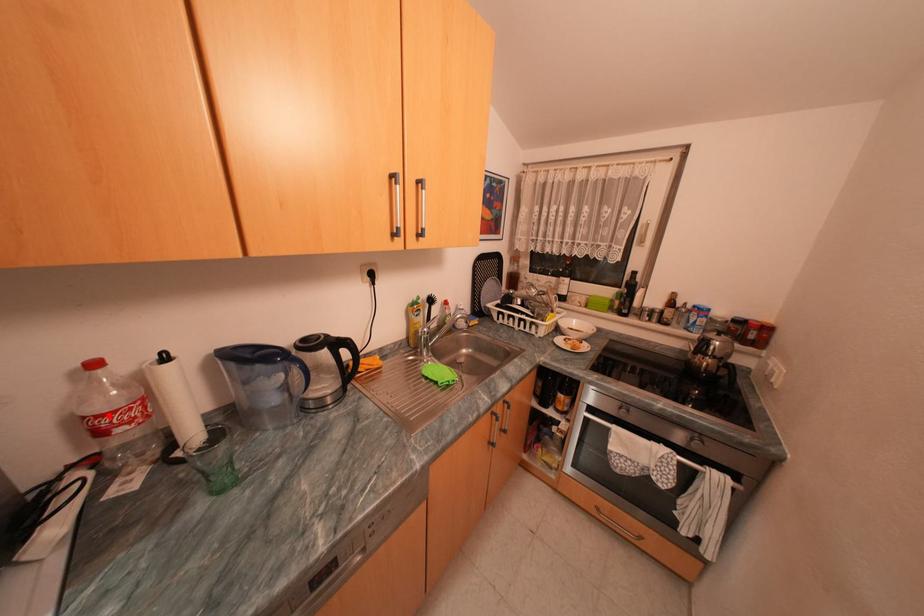
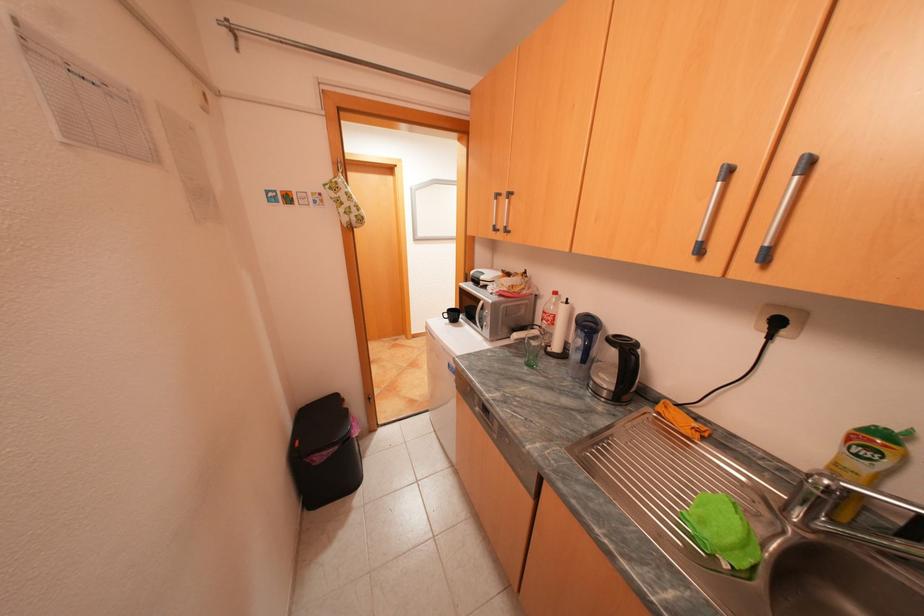
In the second image, find the point that corresponds to the highlighted location in the first image.

(553, 312)